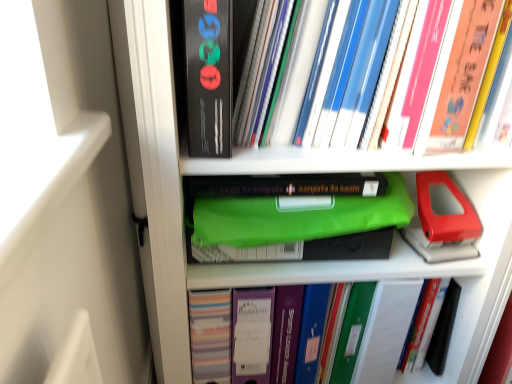
Question: In terms of height, does matte plastic binder at center, marked as the 1th book in a bottom-to-top arrangement, look taller or shorter compared to matte black book at upper center?

Choices:
 (A) short
 (B) tall

Answer: (B)

Question: From the image's perspective, is matte plastic binder at center, marked as the 1th book in a bottom-to-top arrangement, located above or below matte black book at upper center?

Choices:
 (A) above
 (B) below

Answer: (B)

Question: Considering the real-world distances, which object is farthest from the matte plastic binder at center, which ranks as the 2th book in top-to-bottom order?

Choices:
 (A) matte black book at upper center
 (B) hardcover books at upper right, placed as the 1th book when sorted from top to bottom

Answer: (A)

Question: Based on their relative distances, which object is nearer to the matte plastic binder at center, marked as the 1th book in a bottom-to-top arrangement?

Choices:
 (A) matte black book at upper center
 (B) hardcover books at upper right, placed as the 1th book when sorted from top to bottom

Answer: (B)